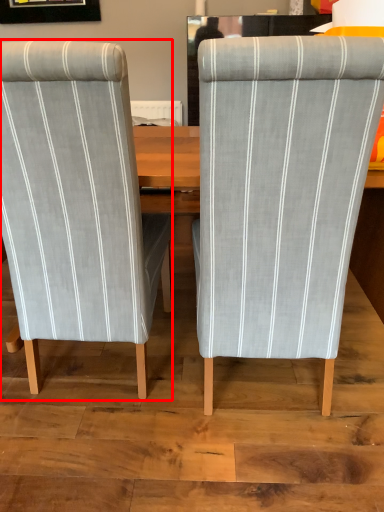
Question: Observing the image, what is the correct spatial positioning of chair (annotated by the red box) in reference to chair?

Choices:
 (A) right
 (B) left

Answer: (B)